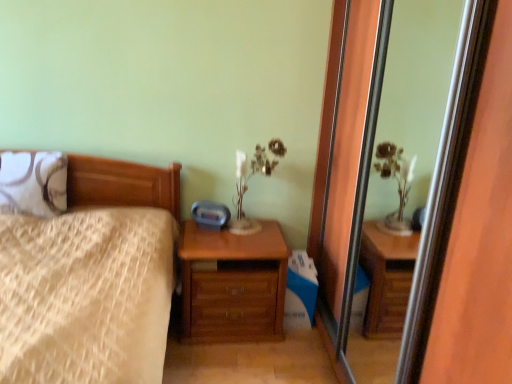
Question: Should I look upward or downward to see wooden bed at left?

Choices:
 (A) up
 (B) down

Answer: (B)

Question: Can you confirm if wooden chest of drawers at lower center is taller than white textured pillow at left?

Choices:
 (A) yes
 (B) no

Answer: (A)

Question: Is wooden chest of drawers at lower center not close to white textured pillow at left?

Choices:
 (A) yes
 (B) no

Answer: (B)

Question: Is wooden chest of drawers at lower center to the left of white textured pillow at left from the viewer's perspective?

Choices:
 (A) yes
 (B) no

Answer: (B)

Question: From a real-world perspective, is wooden chest of drawers at lower center on white textured pillow at left?

Choices:
 (A) yes
 (B) no

Answer: (B)

Question: Is wooden chest of drawers at lower center turned away from white textured pillow at left?

Choices:
 (A) no
 (B) yes

Answer: (A)

Question: Considering the relative sizes of wooden chest of drawers at lower center and white textured pillow at left in the image provided, is wooden chest of drawers at lower center shorter than white textured pillow at left?

Choices:
 (A) no
 (B) yes

Answer: (A)

Question: Is wooden bed at left positioned with its back to transparent glass screen door at center?

Choices:
 (A) yes
 (B) no

Answer: (B)

Question: Can you confirm if wooden bed at left is thinner than transparent glass screen door at center?

Choices:
 (A) no
 (B) yes

Answer: (A)

Question: Is wooden bed at left positioned behind transparent glass screen door at center?

Choices:
 (A) no
 (B) yes

Answer: (B)

Question: From a real-world perspective, is wooden bed at left over transparent glass screen door at center?

Choices:
 (A) no
 (B) yes

Answer: (A)

Question: Is wooden bed at left to the right of transparent glass screen door at center from the viewer's perspective?

Choices:
 (A) yes
 (B) no

Answer: (B)

Question: Can you confirm if wooden bed at left is shorter than transparent glass screen door at center?

Choices:
 (A) yes
 (B) no

Answer: (A)

Question: Is white textured pillow at left inside matte white glass table lamp at upper center?

Choices:
 (A) no
 (B) yes

Answer: (A)